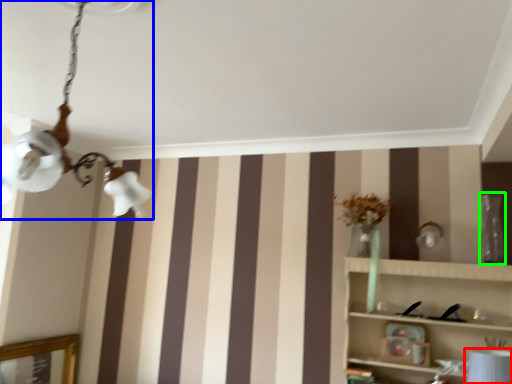
Question: Based on their relative distances, which object is farther from table lamp (highlighted by a red box)? Choose from lamp (highlighted by a blue box) and glass vase (highlighted by a green box).

Choices:
 (A) lamp
 (B) glass vase

Answer: (A)